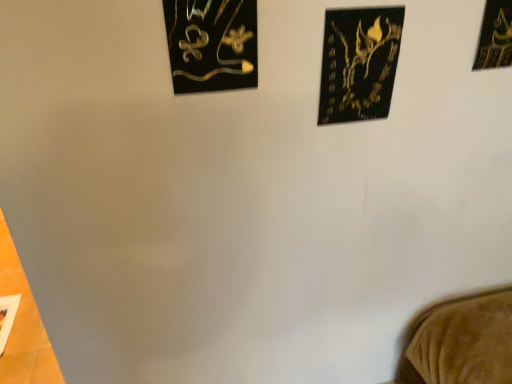
Describe the element at coordinates (212, 44) in the screenshot. I see `metallic gold artwork at upper left, arranged as the 1th picture frame when viewed from the left` at that location.

Image resolution: width=512 pixels, height=384 pixels. What do you see at coordinates (359, 63) in the screenshot?
I see `black matte picture frame at upper center, marked as the 2th picture frame in a right-to-left arrangement` at bounding box center [359, 63].

Identify the location of metallic gold artwork at upper left, arranged as the 1th picture frame when viewed from the left. (212, 44).

How many degrees apart are the facing directions of black matte picture frame at upper center, marked as the 2th picture frame in a right-to-left arrangement, and metallic gold artwork at upper left, arranged as the 1th picture frame when viewed from the left?

3.87 degrees separate the facing orientations of black matte picture frame at upper center, marked as the 2th picture frame in a right-to-left arrangement, and metallic gold artwork at upper left, arranged as the 1th picture frame when viewed from the left.

Is black matte picture frame at upper center, the 2th picture frame from the left, situated inside metallic gold artwork at upper left, the third picture frame when ordered from right to left, or outside?

black matte picture frame at upper center, the 2th picture frame from the left, exists outside the volume of metallic gold artwork at upper left, the third picture frame when ordered from right to left.

Does black matte picture frame at upper center, the 2th picture frame from the left, touch metallic gold artwork at upper left, the third picture frame when ordered from right to left?

No, black matte picture frame at upper center, the 2th picture frame from the left, is not in contact with metallic gold artwork at upper left, the third picture frame when ordered from right to left.

Looking at this image, who is more distant, black matte picture frame at upper center, marked as the 2th picture frame in a right-to-left arrangement, or metallic gold artwork at upper left, arranged as the 1th picture frame when viewed from the left?

black matte picture frame at upper center, marked as the 2th picture frame in a right-to-left arrangement, is further from the camera.

Is metallic gold artwork at upper left, the third picture frame when ordered from right to left, smaller than black matte picture frame at upper center, marked as the 2th picture frame in a right-to-left arrangement?

Incorrect, metallic gold artwork at upper left, the third picture frame when ordered from right to left, is not smaller in size than black matte picture frame at upper center, marked as the 2th picture frame in a right-to-left arrangement.

Is metallic gold artwork at upper left, arranged as the 1th picture frame when viewed from the left, not close to black matte picture frame at upper center, the 2th picture frame from the left?

No, there isn't a large distance between metallic gold artwork at upper left, arranged as the 1th picture frame when viewed from the left, and black matte picture frame at upper center, the 2th picture frame from the left.

From the image's perspective, who appears lower, metallic gold artwork at upper left, the third picture frame when ordered from right to left, or black matte picture frame at upper center, marked as the 2th picture frame in a right-to-left arrangement?

black matte picture frame at upper center, marked as the 2th picture frame in a right-to-left arrangement.

Find the location of a particular element. picture frame behind the black matte picture frame at upper center, the 2th picture frame from the left is located at coordinates (495, 36).

Would you say black matte picture frame at upper center, marked as the 2th picture frame in a right-to-left arrangement, is outside black matte picture frame at upper right, acting as the first picture frame starting from the right?

black matte picture frame at upper center, marked as the 2th picture frame in a right-to-left arrangement, lies outside black matte picture frame at upper right, acting as the first picture frame starting from the right,'s area.

Looking at this image, does black matte picture frame at upper center, the 2th picture frame from the left, have a greater height compared to black matte picture frame at upper right, acting as the first picture frame starting from the right?

Indeed, black matte picture frame at upper center, the 2th picture frame from the left, has a greater height compared to black matte picture frame at upper right, acting as the first picture frame starting from the right.

From the image's perspective, is black matte picture frame at upper center, marked as the 2th picture frame in a right-to-left arrangement, above or below black matte picture frame at upper right, acting as the 3th picture frame starting from the left?

Clearly, from the image's perspective, black matte picture frame at upper center, marked as the 2th picture frame in a right-to-left arrangement, is below black matte picture frame at upper right, acting as the 3th picture frame starting from the left.

From a real-world perspective, is metallic gold artwork at upper left, the third picture frame when ordered from right to left, physically above black matte picture frame at upper right, acting as the first picture frame starting from the right?

Incorrect, from a real-world perspective, metallic gold artwork at upper left, the third picture frame when ordered from right to left, is lower than black matte picture frame at upper right, acting as the first picture frame starting from the right.

Locate an element on the screen. The width and height of the screenshot is (512, 384). the 2nd picture frame behind when counting from the metallic gold artwork at upper left, arranged as the 1th picture frame when viewed from the left is located at coordinates (495, 36).

From the image's perspective, would you say metallic gold artwork at upper left, arranged as the 1th picture frame when viewed from the left, is positioned over black matte picture frame at upper right, acting as the 3th picture frame starting from the left?

Incorrect, from the image's perspective, metallic gold artwork at upper left, arranged as the 1th picture frame when viewed from the left, is lower than black matte picture frame at upper right, acting as the 3th picture frame starting from the left.

Would you say metallic gold artwork at upper left, arranged as the 1th picture frame when viewed from the left, contains black matte picture frame at upper right, acting as the 3th picture frame starting from the left?

No, black matte picture frame at upper right, acting as the 3th picture frame starting from the left, is not surrounded by metallic gold artwork at upper left, arranged as the 1th picture frame when viewed from the left.

Considering the relative positions of black matte picture frame at upper right, acting as the first picture frame starting from the right, and metallic gold artwork at upper left, arranged as the 1th picture frame when viewed from the left, in the image provided, is black matte picture frame at upper right, acting as the first picture frame starting from the right, in front of metallic gold artwork at upper left, arranged as the 1th picture frame when viewed from the left,?

No, black matte picture frame at upper right, acting as the first picture frame starting from the right, is further to the viewer.

Does black matte picture frame at upper right, acting as the first picture frame starting from the right, have a greater height compared to metallic gold artwork at upper left, the third picture frame when ordered from right to left?

Yes, black matte picture frame at upper right, acting as the first picture frame starting from the right, is taller than metallic gold artwork at upper left, the third picture frame when ordered from right to left.

Is black matte picture frame at upper right, acting as the 3th picture frame starting from the left, positioned far away from metallic gold artwork at upper left, the third picture frame when ordered from right to left?

No, black matte picture frame at upper right, acting as the 3th picture frame starting from the left, is in close proximity to metallic gold artwork at upper left, the third picture frame when ordered from right to left.

You are a GUI agent. You are given a task and a screenshot of the screen. Output one action in this format:
    pyautogui.click(x=<x>, y=<y>)
    Task: Click on the 2nd picture frame counting from the right of the metallic gold artwork at upper left, arranged as the 1th picture frame when viewed from the left
    The width and height of the screenshot is (512, 384).
    Given the screenshot: What is the action you would take?
    pyautogui.click(x=495, y=36)

Which of these two, black matte picture frame at upper right, acting as the first picture frame starting from the right, or black matte picture frame at upper center, marked as the 2th picture frame in a right-to-left arrangement, stands taller?

Standing taller between the two is black matte picture frame at upper center, marked as the 2th picture frame in a right-to-left arrangement.

Which object is positioned more to the right, black matte picture frame at upper right, acting as the first picture frame starting from the right, or black matte picture frame at upper center, marked as the 2th picture frame in a right-to-left arrangement?

black matte picture frame at upper right, acting as the first picture frame starting from the right.

You are a GUI agent. You are given a task and a screenshot of the screen. Output one action in this format:
    pyautogui.click(x=<x>, y=<y>)
    Task: Click on the picture frame that is the 2nd one when counting downward from the black matte picture frame at upper right, acting as the first picture frame starting from the right (from the image's perspective)
    
    Given the screenshot: What is the action you would take?
    pyautogui.click(x=359, y=63)

Could you tell me if black matte picture frame at upper right, acting as the 3th picture frame starting from the left, is turned towards black matte picture frame at upper center, the 2th picture frame from the left?

No, black matte picture frame at upper right, acting as the 3th picture frame starting from the left, is not facing towards black matte picture frame at upper center, the 2th picture frame from the left.

Which picture frame is the 1st one when counting from the right side of the metallic gold artwork at upper left, arranged as the 1th picture frame when viewed from the left? Please provide its 2D coordinates.

[(359, 63)]

You are a GUI agent. You are given a task and a screenshot of the screen. Output one action in this format:
    pyautogui.click(x=<x>, y=<y>)
    Task: Click on the picture frame below the metallic gold artwork at upper left, the third picture frame when ordered from right to left (from a real-world perspective)
    This screenshot has height=384, width=512.
    Given the screenshot: What is the action you would take?
    pyautogui.click(x=359, y=63)

Based on the photo, considering their positions, is black matte picture frame at upper center, the 2th picture frame from the left, positioned closer to metallic gold artwork at upper left, arranged as the 1th picture frame when viewed from the left, than black matte picture frame at upper right, acting as the first picture frame starting from the right?

The object closer to metallic gold artwork at upper left, arranged as the 1th picture frame when viewed from the left, is black matte picture frame at upper center, the 2th picture frame from the left.

Considering their positions, is black matte picture frame at upper right, acting as the 3th picture frame starting from the left, positioned further to black matte picture frame at upper center, the 2th picture frame from the left, than metallic gold artwork at upper left, arranged as the 1th picture frame when viewed from the left?

black matte picture frame at upper right, acting as the 3th picture frame starting from the left, is positioned further to the anchor black matte picture frame at upper center, the 2th picture frame from the left.

When comparing their distances from metallic gold artwork at upper left, the third picture frame when ordered from right to left, does black matte picture frame at upper right, acting as the first picture frame starting from the right, or black matte picture frame at upper center, marked as the 2th picture frame in a right-to-left arrangement, seem further?

Among the two, black matte picture frame at upper right, acting as the first picture frame starting from the right, is located further to metallic gold artwork at upper left, the third picture frame when ordered from right to left.

Looking at this image, from the image, which object appears to be farther from black matte picture frame at upper right, acting as the first picture frame starting from the right, black matte picture frame at upper center, the 2th picture frame from the left, or metallic gold artwork at upper left, the third picture frame when ordered from right to left?

The object further to black matte picture frame at upper right, acting as the first picture frame starting from the right, is metallic gold artwork at upper left, the third picture frame when ordered from right to left.

From the image, which object appears to be nearer to black matte picture frame at upper right, acting as the first picture frame starting from the right, metallic gold artwork at upper left, the third picture frame when ordered from right to left, or black matte picture frame at upper center, marked as the 2th picture frame in a right-to-left arrangement?

Among the two, black matte picture frame at upper center, marked as the 2th picture frame in a right-to-left arrangement, is located nearer to black matte picture frame at upper right, acting as the first picture frame starting from the right.

Which object lies nearer to the anchor point black matte picture frame at upper center, the 2th picture frame from the left, metallic gold artwork at upper left, the third picture frame when ordered from right to left, or black matte picture frame at upper right, acting as the 3th picture frame starting from the left?

metallic gold artwork at upper left, the third picture frame when ordered from right to left, lies closer to black matte picture frame at upper center, the 2th picture frame from the left, than the other object.

Where is `picture frame between metallic gold artwork at upper left, arranged as the 1th picture frame when viewed from the left, and black matte picture frame at upper right, acting as the first picture frame starting from the right`? picture frame between metallic gold artwork at upper left, arranged as the 1th picture frame when viewed from the left, and black matte picture frame at upper right, acting as the first picture frame starting from the right is located at coordinates (359, 63).